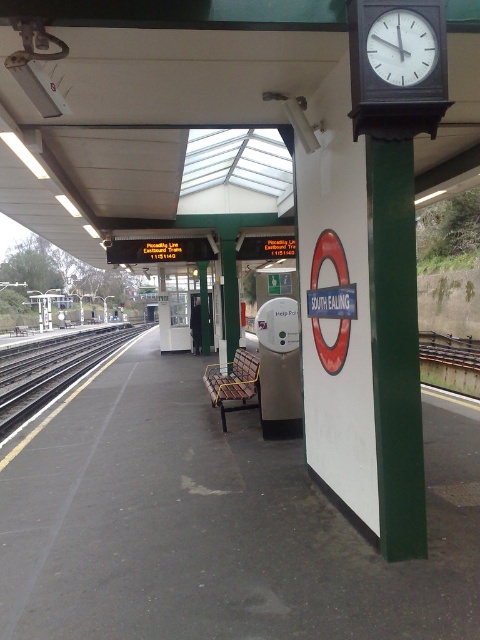
You are standing on the South Ealing station platform and want to determine which of the two points, point (x=442, y=577) or point (x=395, y=186), is closer to you. Based on the platform layout, which point is nearer?

Point (x=442, y=577) is closer to the viewer than point (x=395, y=186).

You are standing on the South Ealing station platform and need to locate the green polished pole at right. According to the platform layout, where should you look relative to the London Underground logo with the red circle?

The green polished pole at right is positioned to the right side of the platform, near the right edge. Since the London Underground logo with the red circle is on the right side of the image, the green polished pole at right is likely located adjacent or nearby the logo, possibly below or to the side of it, but the exact spatial relationship requires checking the platform layout.